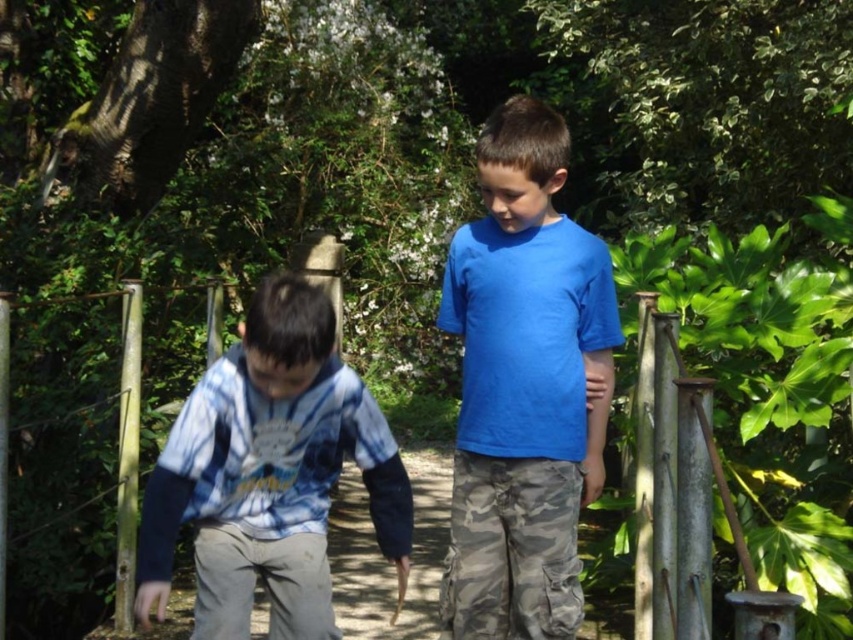
Question: Which point appears closest to the camera in this image?

Choices:
 (A) (288, 280)
 (B) (485, 572)

Answer: (A)

Question: Can you confirm if blue matte shirt at center is positioned above tie-dye fabric shirt at left?

Choices:
 (A) yes
 (B) no

Answer: (A)

Question: Which object is closer to the camera taking this photo?

Choices:
 (A) blue matte shirt at center
 (B) tie-dye fabric shirt at left

Answer: (B)

Question: Among these points, which one is nearest to the camera?

Choices:
 (A) (310, 563)
 (B) (581, 499)

Answer: (A)

Question: Can you confirm if blue matte shirt at center is positioned below tie-dye fabric shirt at left?

Choices:
 (A) yes
 (B) no

Answer: (B)

Question: Does blue matte shirt at center appear over tie-dye fabric shirt at left?

Choices:
 (A) no
 (B) yes

Answer: (B)